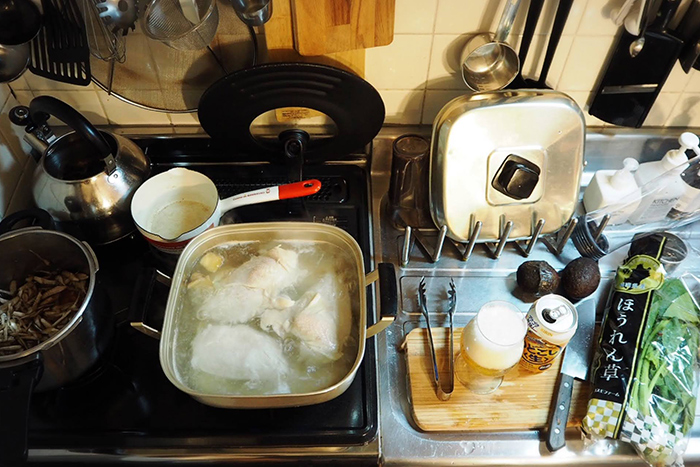
Locate an element on the screen. This screenshot has height=467, width=700. cutting board is located at coordinates (466, 416).